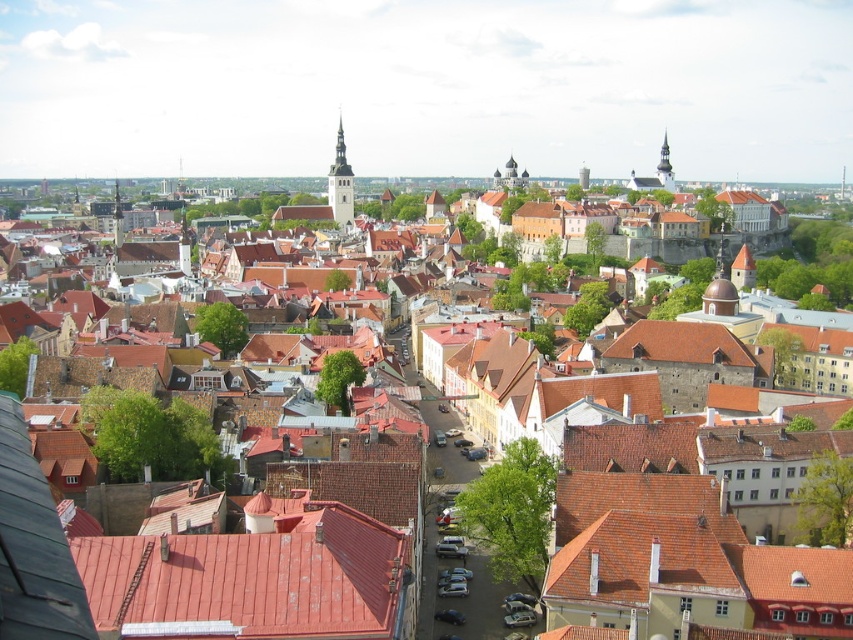
Question: Where is red tile roof at center located in relation to smooth stone tower at center in the image?

Choices:
 (A) above
 (B) below

Answer: (B)

Question: Does red tile roof at center lie behind smooth stone tower at center?

Choices:
 (A) no
 (B) yes

Answer: (A)

Question: Which point appears closest to the camera in this image?

Choices:
 (A) (668, 161)
 (B) (128, 628)
 (C) (345, 198)

Answer: (B)

Question: Which object is the closest to the red tile roof at center?

Choices:
 (A) smooth stone tower at center
 (B) smooth stone tower at upper right

Answer: (A)

Question: Does smooth stone tower at center come behind smooth stone tower at upper right?

Choices:
 (A) no
 (B) yes

Answer: (A)

Question: Which point is closer to the camera?

Choices:
 (A) smooth stone tower at upper right
 (B) red tile roof at center
 (C) smooth stone tower at center

Answer: (B)